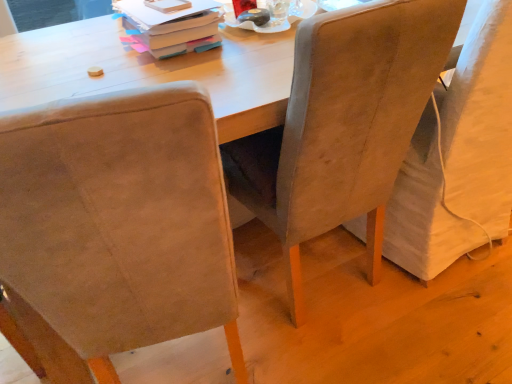
Question: Can suede-like beige chair at left, placed as the 3th chair when sorted from right to left, be found inside matte cardboard book at upper center?

Choices:
 (A) no
 (B) yes

Answer: (A)

Question: Considering the relative sizes of matte cardboard book at upper center and suede-like beige chair at left, placed as the 3th chair when sorted from right to left, in the image provided, is matte cardboard book at upper center taller than suede-like beige chair at left, placed as the 3th chair when sorted from right to left,?

Choices:
 (A) no
 (B) yes

Answer: (A)

Question: Can you confirm if matte cardboard book at upper center is smaller than suede-like beige chair at left, the first chair viewed from the left?

Choices:
 (A) yes
 (B) no

Answer: (A)

Question: Can you confirm if matte cardboard book at upper center is bigger than suede-like beige chair at left, placed as the 3th chair when sorted from right to left?

Choices:
 (A) no
 (B) yes

Answer: (A)

Question: Considering the relative sizes of matte cardboard book at upper center and suede-like beige chair at left, the first chair viewed from the left, in the image provided, is matte cardboard book at upper center wider than suede-like beige chair at left, the first chair viewed from the left,?

Choices:
 (A) no
 (B) yes

Answer: (A)

Question: Relative to suede-like beige chair at left, the first chair viewed from the left, is suede-like beige chair at center, which is the second chair from right to left, in front or behind?

Choices:
 (A) behind
 (B) front

Answer: (A)

Question: Looking at the image, does suede-like beige chair at center, which is the second chair from right to left, seem bigger or smaller compared to suede-like beige chair at left, placed as the 3th chair when sorted from right to left?

Choices:
 (A) small
 (B) big

Answer: (A)

Question: Looking at their shapes, would you say suede-like beige chair at center, acting as the 2th chair starting from the left, is wider or thinner than suede-like beige chair at left, the first chair viewed from the left?

Choices:
 (A) wide
 (B) thin

Answer: (B)

Question: From the image's perspective, relative to suede-like beige chair at left, placed as the 3th chair when sorted from right to left, is suede-like beige chair at center, acting as the 2th chair starting from the left, above or below?

Choices:
 (A) above
 (B) below

Answer: (A)

Question: Does point (160, 54) appear closer or farther from the camera than point (501, 175)?

Choices:
 (A) closer
 (B) farther

Answer: (A)

Question: Considering the positions of matte cardboard book at upper center and suede-like beige chair at right, which is the 1th chair from right to left, in the image, is matte cardboard book at upper center bigger or smaller than suede-like beige chair at right, which is the 1th chair from right to left,?

Choices:
 (A) big
 (B) small

Answer: (B)

Question: Is matte cardboard book at upper center in front of or behind suede-like beige chair at right, which is the 1th chair from right to left, in the image?

Choices:
 (A) front
 (B) behind

Answer: (B)

Question: In terms of width, does matte cardboard book at upper center look wider or thinner when compared to suede-like beige chair at right, which ranks as the third chair in left-to-right order?

Choices:
 (A) thin
 (B) wide

Answer: (A)

Question: In terms of height, does matte cardboard book at upper center look taller or shorter compared to suede-like beige chair at center, acting as the 2th chair starting from the left?

Choices:
 (A) short
 (B) tall

Answer: (A)

Question: Considering the positions of point (133, 1) and point (293, 225), is point (133, 1) closer or farther from the camera than point (293, 225)?

Choices:
 (A) closer
 (B) farther

Answer: (B)